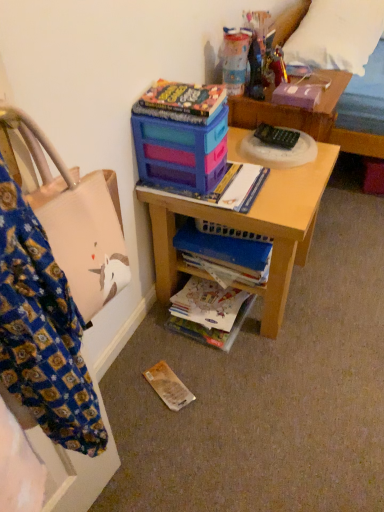
Question: Considering the positions of matte paper book at lower center, which is the 2th book from top to bottom, and hardcover book at upper right, positioned as the 3th paperback book in front-to-back order, in the image, is matte paper book at lower center, which is the 2th book from top to bottom, taller or shorter than hardcover book at upper right, positioned as the 3th paperback book in front-to-back order,?

Choices:
 (A) short
 (B) tall

Answer: (B)

Question: Is point (193, 312) positioned closer to the camera than point (291, 94)?

Choices:
 (A) closer
 (B) farther

Answer: (A)

Question: Considering the real-world distances, which object is farthest from the hardcover book at upper center, which is counted as the 1th paperback book, starting from the front?

Choices:
 (A) metallic gold figurine at upper center, which is the first toy in right-to-left order
 (B) blue matte book at center, marked as the first book in a top-to-bottom arrangement
 (C) brown paper book at lower center, acting as the second paperback book starting from the back
 (D) wooden desk at center
 (E) translucent plastic container at upper center, marked as the second toy in a right-to-left arrangement

Answer: (C)

Question: Which of these objects is positioned closest to the hardcover book at upper center, which ranks as the 2th paperback book in bottom-to-top order?

Choices:
 (A) black plastic remote control at center
 (B) matte plastic magazine at center
 (C) blue matte book at center, the 2th book positioned from the bottom
 (D) metallic gold figurine at upper center, which is the first toy in right-to-left order
 (E) wooden bed at upper right

Answer: (B)